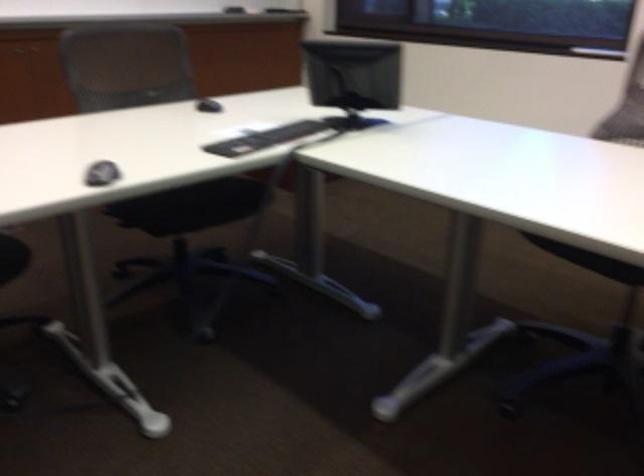
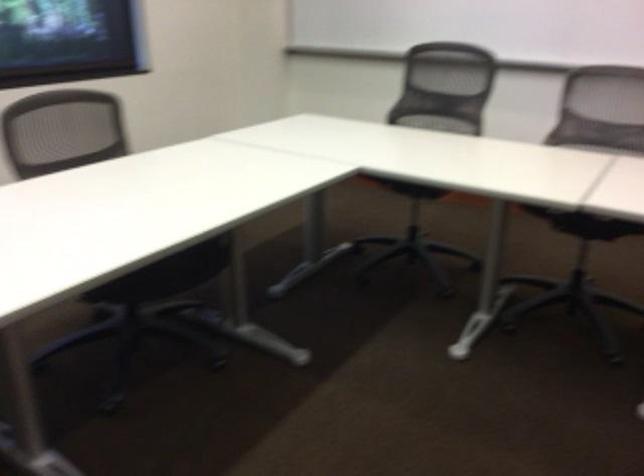
How did the camera likely rotate?

The camera rotated toward right-down.